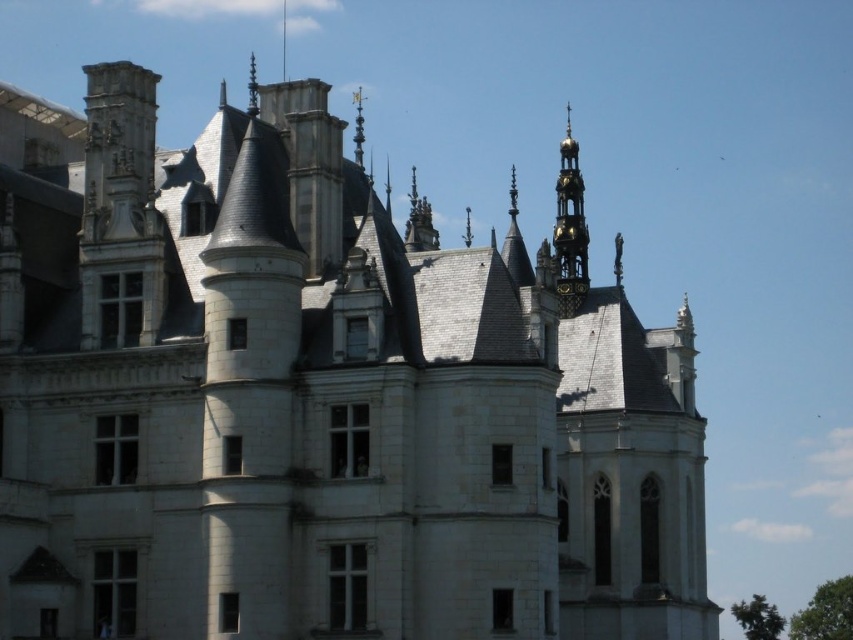
Does gold polished spire at upper center appear under gold metallic spire at upper center?

Yes.

Which is more to the left, gold polished spire at upper center or gold metallic spire at upper center?

gold metallic spire at upper center is more to the left.

Identify the location of gold polished spire at upper center. The height and width of the screenshot is (640, 853). (358, 125).

Is the position of gold plated spire at upper right more distant than that of gold metallic spire at upper center?

No, gold plated spire at upper right is in front of gold metallic spire at upper center.

Which of these two, gold plated spire at upper right or gold metallic spire at upper center, stands shorter?

With less height is gold metallic spire at upper center.

Does point (581, 228) come farther from viewer compared to point (254, 83)?

That is True.

The height and width of the screenshot is (640, 853). In order to click on gold plated spire at upper right in this screenshot , I will do `click(569, 228)`.

Who is positioned more to the left, gold plated spire at upper right or gold polished spire at upper center?

gold polished spire at upper center

Is point (567, 314) behind point (357, 161)?

That is True.

This screenshot has height=640, width=853. Find the location of `gold plated spire at upper right`. gold plated spire at upper right is located at coordinates (569, 228).